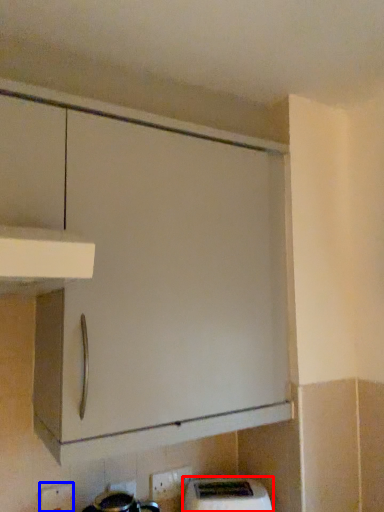
Question: Which of the following is the farthest to the observer, home appliance (highlighted by a red box) or electric outlet (highlighted by a blue box)?

Choices:
 (A) home appliance
 (B) electric outlet

Answer: (A)